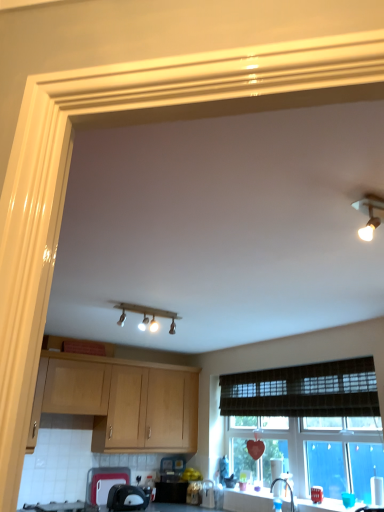
Question: Would you consider black plastic toaster at lower center, which is counted as the third appliance, starting from the right, to be distant from light wood cabinet at upper left?

Choices:
 (A) yes
 (B) no

Answer: (B)

Question: Is black plastic toaster at lower center, the second appliance in the left-to-right sequence, thinner than light wood cabinet at upper left?

Choices:
 (A) yes
 (B) no

Answer: (A)

Question: Can you confirm if black plastic toaster at lower center, which is counted as the third appliance, starting from the right, is bigger than light wood cabinet at upper left?

Choices:
 (A) yes
 (B) no

Answer: (B)

Question: From the image's perspective, is black plastic toaster at lower center, which is counted as the third appliance, starting from the right, on top of light wood cabinet at upper left?

Choices:
 (A) yes
 (B) no

Answer: (B)

Question: Considering the relative positions of black plastic toaster at lower center, which is counted as the third appliance, starting from the right, and light wood cabinet at upper left in the image provided, is black plastic toaster at lower center, which is counted as the third appliance, starting from the right, to the left of light wood cabinet at upper left from the viewer's perspective?

Choices:
 (A) no
 (B) yes

Answer: (A)

Question: Is black plastic toaster at lower center, which is counted as the third appliance, starting from the right, shorter than light wood cabinet at upper left?

Choices:
 (A) yes
 (B) no

Answer: (A)

Question: Is black glass gas stove at lower left located outside white glossy countertop at lower center?

Choices:
 (A) no
 (B) yes

Answer: (B)

Question: Is black glass gas stove at lower left facing towards white glossy countertop at lower center?

Choices:
 (A) yes
 (B) no

Answer: (B)

Question: Is black glass gas stove at lower left further to camera compared to white glossy countertop at lower center?

Choices:
 (A) no
 (B) yes

Answer: (B)

Question: From a real-world perspective, is black glass gas stove at lower left under white glossy countertop at lower center?

Choices:
 (A) yes
 (B) no

Answer: (A)

Question: Considering the relative sizes of black glass gas stove at lower left and white glossy countertop at lower center in the image provided, is black glass gas stove at lower left smaller than white glossy countertop at lower center?

Choices:
 (A) no
 (B) yes

Answer: (A)

Question: Is black glass gas stove at lower left next to white glossy countertop at lower center and touching it?

Choices:
 (A) no
 (B) yes

Answer: (A)

Question: Does matte wood light fixture at upper center appear on the left side of black plastic toaster at lower center, which is counted as the third appliance, starting from the right?

Choices:
 (A) yes
 (B) no

Answer: (B)